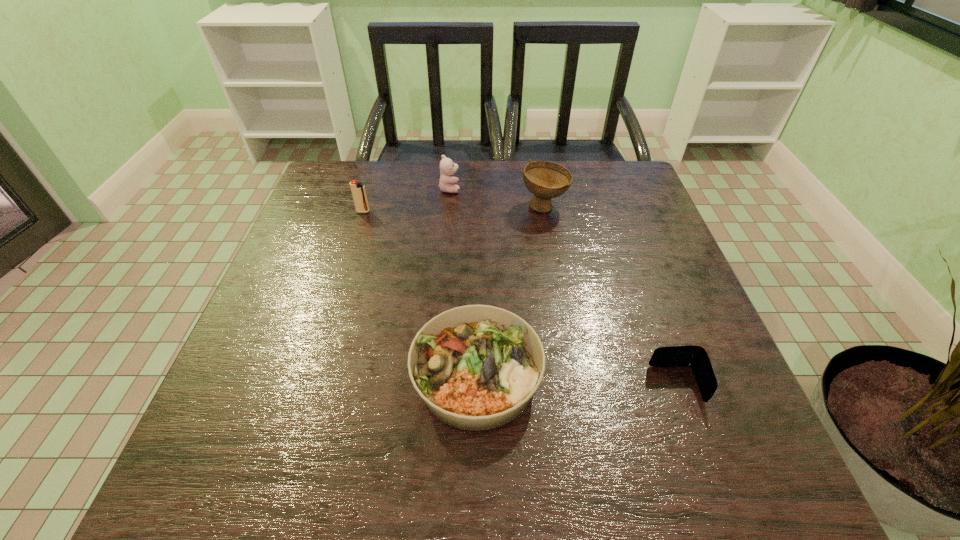
What are the coordinates of `free space located on the outer surface of the rightmost object` in the screenshot? It's located at (489, 384).

I want to click on free space located 0.270m on the outer surface of the rightmost object, so click(505, 384).

Locate an element on the screen. The image size is (960, 540). free point located 0.360m on the outer surface of the rightmost object is located at coordinates (456, 384).

You are a GUI agent. You are given a task and a screenshot of the screen. Output one action in this format:
    pyautogui.click(x=<x>, y=<y>)
    Task: Click on the soup bowl that is at the far edge
    
    Given the screenshot: What is the action you would take?
    pyautogui.click(x=546, y=180)

The image size is (960, 540). Identify the location of teddy bear that is positioned at the far edge. (447, 167).

Locate an element on the screen. The width and height of the screenshot is (960, 540). object that is at the left edge is located at coordinates (358, 191).

Identify the location of object situated at the right edge. The width and height of the screenshot is (960, 540). pos(695,357).

At what (x,y) coordinates should I click in order to perform the action: click on vacant area at the far edge. Please return your answer as a coordinate pair (x, y). The height and width of the screenshot is (540, 960). Looking at the image, I should click on pyautogui.click(x=411, y=161).

Identify the location of free location at the left edge of the desktop. (326, 250).

Find the location of a particular element. vacant space at the right edge of the desktop is located at coordinates (650, 405).